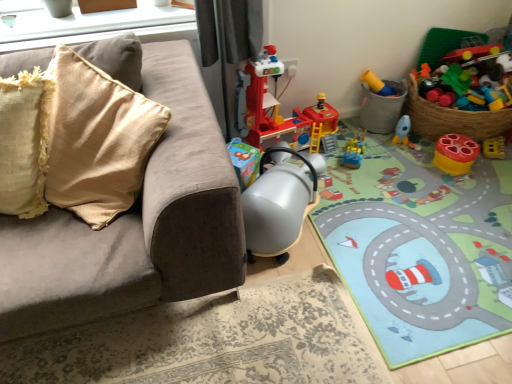
The image size is (512, 384). What are the coordinates of `free location in front of plastic yellow toy at upper right, which ranks as the fourth toy in right-to-left order` in the screenshot? It's located at (392, 145).